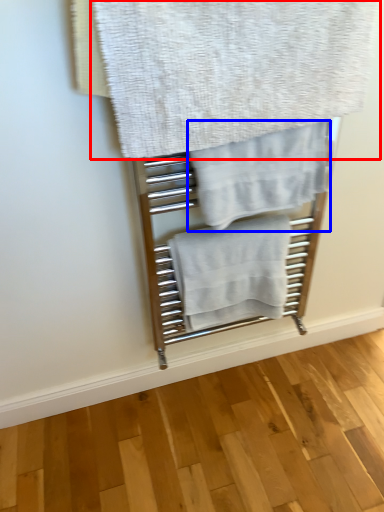
Question: Which point is closer to the camera, towel (highlighted by a red box) or towel (highlighted by a blue box)?

Choices:
 (A) towel
 (B) towel

Answer: (A)